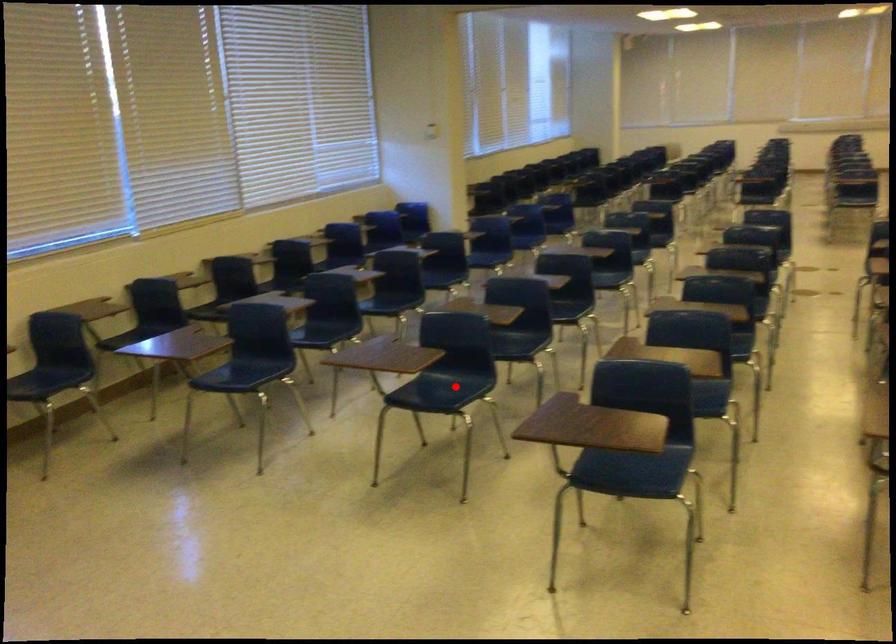
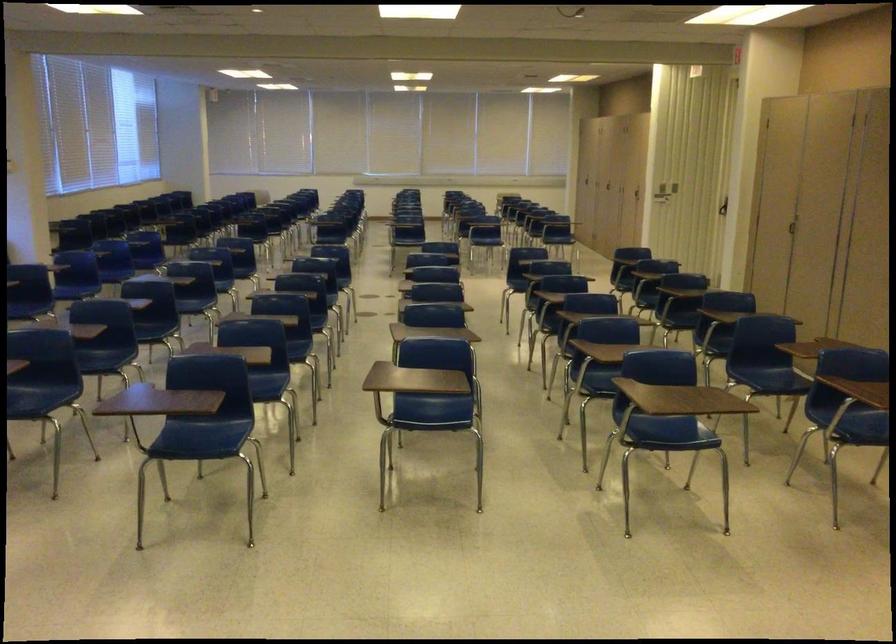
Question: I am providing you with two images of the same scene from different viewpoints. A red point is marked on the first image. Is the red point's position out of view in image 2?

Choices:
 (A) Yes
 (B) No

Answer: (B)